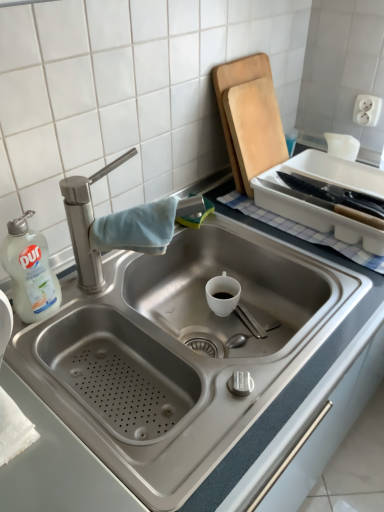
The image size is (384, 512). I want to click on spots to the right of white plastic bottle at left, so click(104, 304).